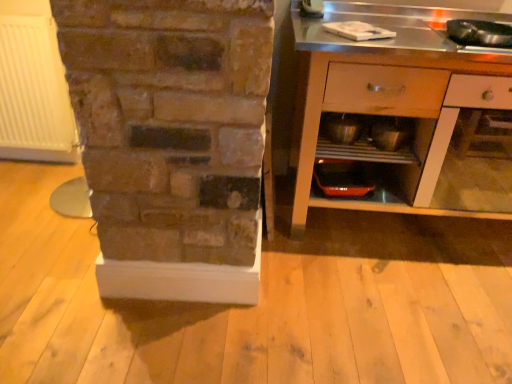
Question: Considering the relative sizes of metallic silver cabinet at right and metallic silver shelf at lower center in the image provided, is metallic silver cabinet at right smaller than metallic silver shelf at lower center?

Choices:
 (A) yes
 (B) no

Answer: (B)

Question: Considering the relative sizes of metallic silver cabinet at right and metallic silver shelf at lower center in the image provided, is metallic silver cabinet at right thinner than metallic silver shelf at lower center?

Choices:
 (A) yes
 (B) no

Answer: (B)

Question: From the image's perspective, is metallic silver cabinet at right below metallic silver shelf at lower center?

Choices:
 (A) no
 (B) yes

Answer: (A)

Question: Does metallic silver cabinet at right appear on the left side of metallic silver shelf at lower center?

Choices:
 (A) yes
 (B) no

Answer: (B)

Question: Does metallic silver cabinet at right have a greater height compared to metallic silver shelf at lower center?

Choices:
 (A) yes
 (B) no

Answer: (A)

Question: Can you confirm if metallic silver cabinet at right is shorter than metallic silver shelf at lower center?

Choices:
 (A) no
 (B) yes

Answer: (A)

Question: From a real-world perspective, is metallic silver shelf at lower center below metallic silver cabinet at right?

Choices:
 (A) no
 (B) yes

Answer: (A)

Question: Can you confirm if metallic silver shelf at lower center is positioned to the left of metallic silver cabinet at right?

Choices:
 (A) no
 (B) yes

Answer: (B)

Question: Does metallic silver shelf at lower center come behind metallic silver cabinet at right?

Choices:
 (A) yes
 (B) no

Answer: (A)

Question: Does metallic silver shelf at lower center have a larger size compared to metallic silver cabinet at right?

Choices:
 (A) no
 (B) yes

Answer: (A)

Question: From the image's perspective, is metallic silver shelf at lower center located above metallic silver cabinet at right?

Choices:
 (A) no
 (B) yes

Answer: (A)

Question: Considering the relative sizes of metallic silver shelf at lower center and metallic silver cabinet at right in the image provided, is metallic silver shelf at lower center taller than metallic silver cabinet at right?

Choices:
 (A) no
 (B) yes

Answer: (A)

Question: Does metallic silver cabinet at right have a lesser width compared to metallic silver bowl at center?

Choices:
 (A) no
 (B) yes

Answer: (A)